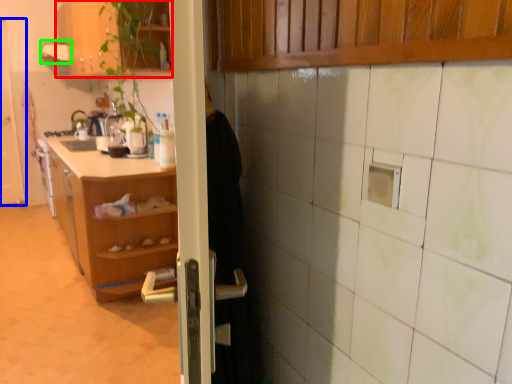
Question: Which is farther away from cabinetry (highlighted by a red box)? door (highlighted by a blue box) or exhaust hood (highlighted by a green box)?

Choices:
 (A) door
 (B) exhaust hood

Answer: (A)